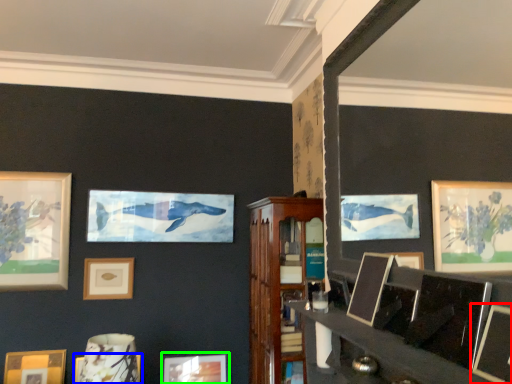
Question: Which object is the closest to the picture frame (highlighted by a red box)? Choose among these: picture frame (highlighted by a blue box) or picture frame (highlighted by a green box).

Choices:
 (A) picture frame
 (B) picture frame

Answer: (A)